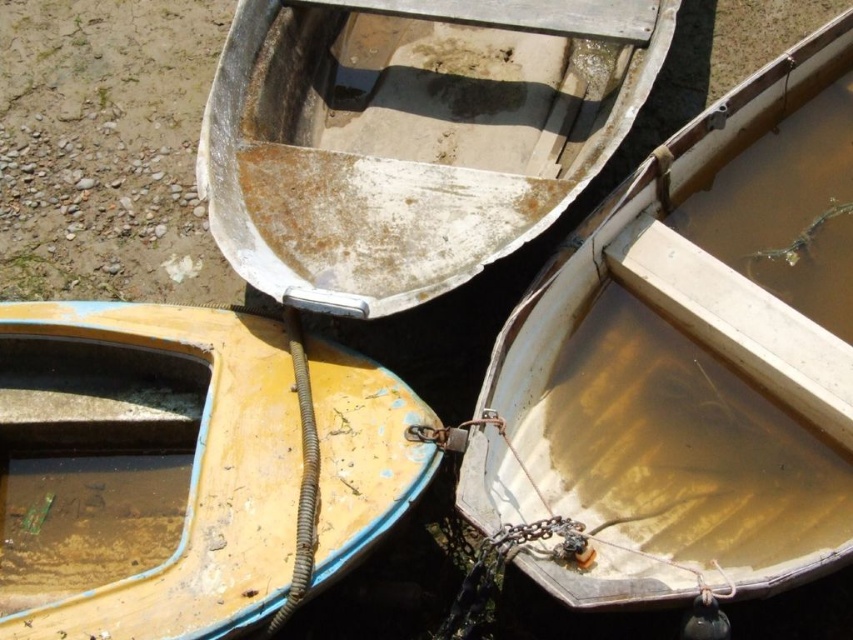
Where is the yellow matte boat at lower left located in the image?

The yellow matte boat at lower left is located at point (143, 470) in the image.

You are standing at the edge of the water body looking at the yellow matte boat at lower left and the wooden boat at center. Which boat is closer to your left side?

The yellow matte boat at lower left is closer to your left side since it is positioned to the left of the wooden boat at center.

In the scene shown: You are standing at the origin point of the coordinate system. You want to move to the yellow matte boat at lower left. Which direction should you move in?

To reach the yellow matte boat at lower left, you should move towards the lower left direction since its coordinates are at point (143,470).